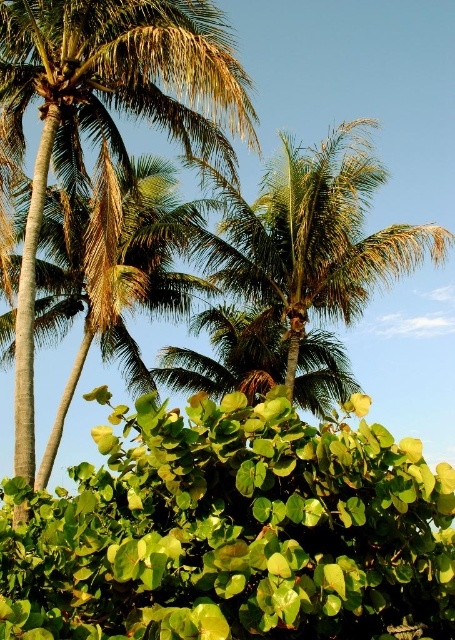
You are a botanist examining two green leafy palms in a tropical scene. You notice both the green leafy palm at center and the green leafy palm tree at center. Which one has a bigger size?

The green leafy palm at center is larger in size than the green leafy palm tree at center.

You are a photographer trying to capture a detailed shot of two points in a tropical landscape. The first point is at coordinates point (277,179), and the second is at point (136,228). Based on the scene, which point is positioned closer to your camera lens?

Point (277,179) is closer to the camera than point (136,228).

From the picture: You are a botanist studying palm trees in this tropical scene. You notice two palm trees labeled as green leafy palm at center and green leafy palm tree at center. Which one is taller?

The green leafy palm at center is taller than the green leafy palm tree at center.